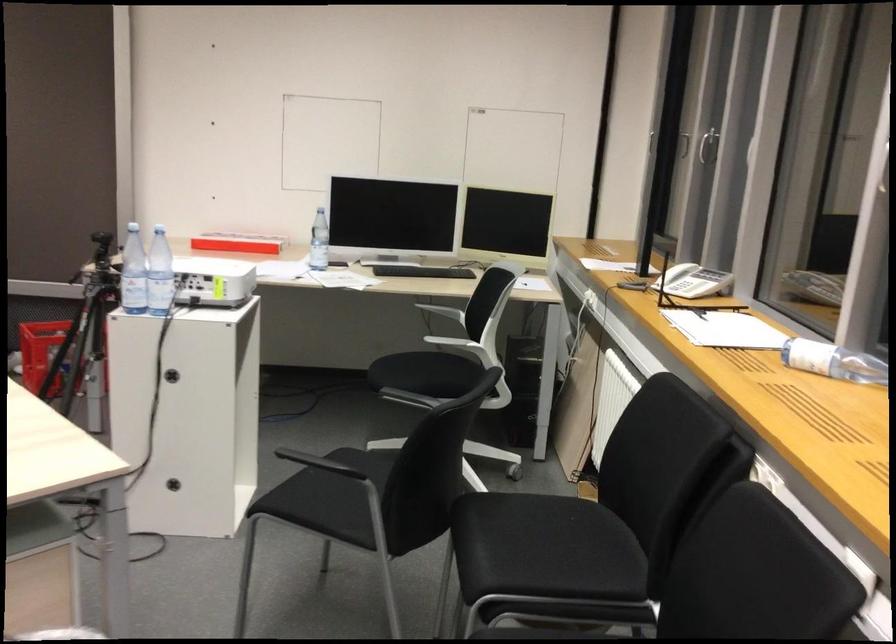
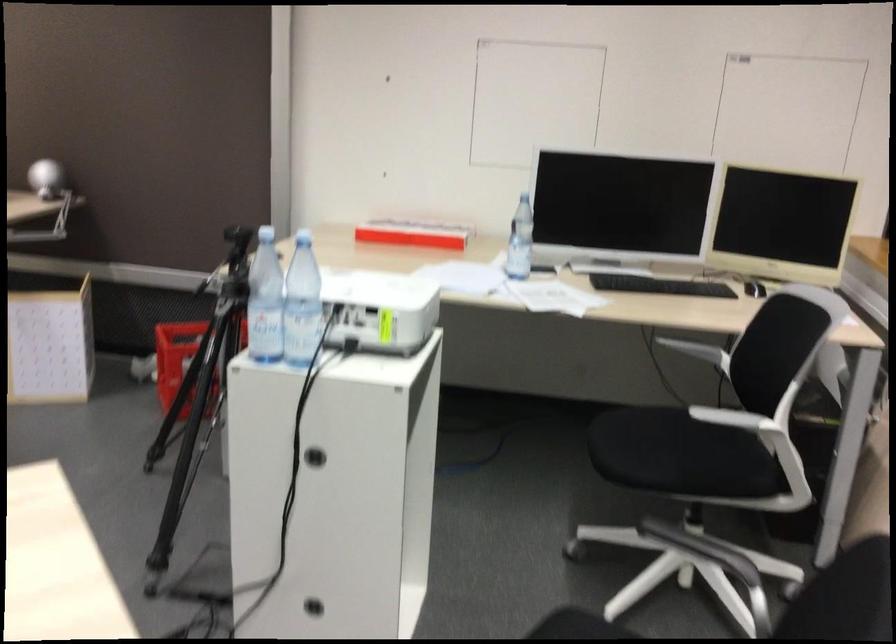
Locate, in the second image, the point that corresponds to pixel 317 243 in the first image.

(520, 241)